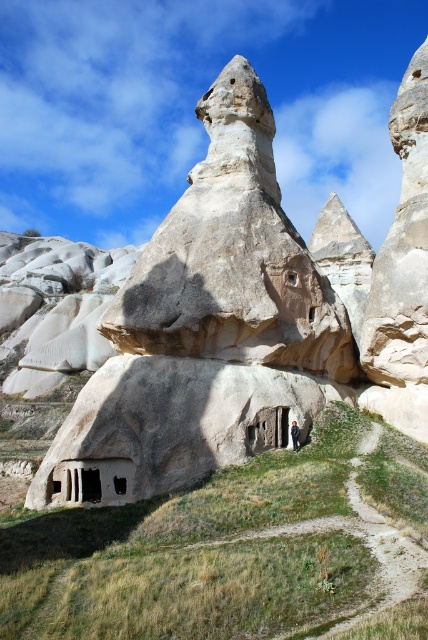
Question: Is beige stone rock formation at center below smooth beige rock formation at center?

Choices:
 (A) yes
 (B) no

Answer: (B)

Question: Which of the following is the farthest from the observer?

Choices:
 (A) (285, 444)
 (B) (296, 445)
 (C) (225, 481)

Answer: (A)

Question: Can you confirm if beige stone rock formation at center is positioned below smooth beige rock formation at center?

Choices:
 (A) yes
 (B) no

Answer: (B)

Question: Which object is positioned farthest from the smooth beige rock formation at center?

Choices:
 (A) light brown leather jacket at center
 (B) beige stone rock formation at center

Answer: (A)

Question: Estimate the real-world distances between objects in this image. Which object is farther from the light brown leather jacket at center?

Choices:
 (A) beige stone rock formation at center
 (B) smooth beige rock formation at center

Answer: (A)

Question: Can you confirm if smooth beige rock formation at center is bigger than light brown leather jacket at center?

Choices:
 (A) yes
 (B) no

Answer: (A)